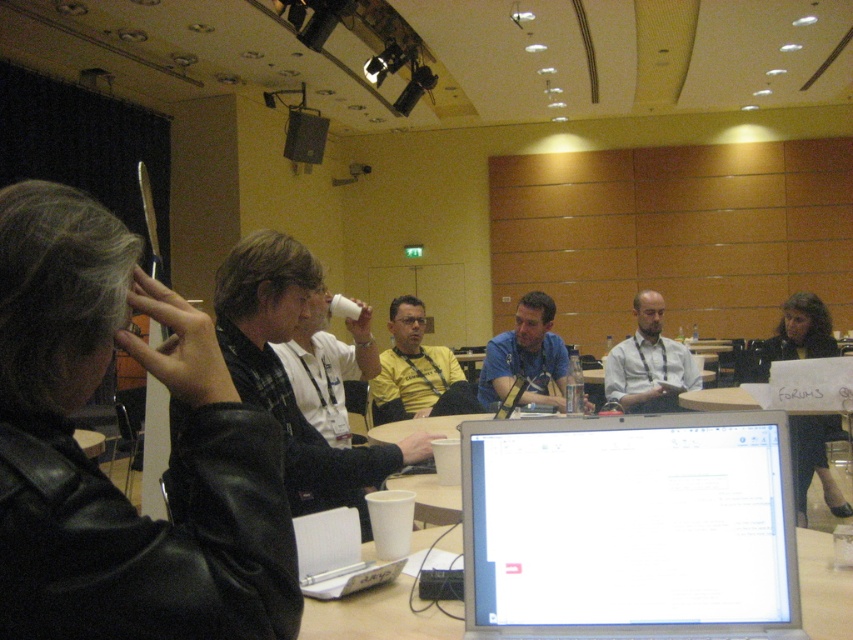
Who is more distant from viewer, (306, 269) or (347, 564)?

The point (306, 269) is more distant.

Looking at this image, is white matte cup at center below white plastic laptop at center?

No, white matte cup at center is not below white plastic laptop at center.

In the scene shown: Who is more distant from viewer, (x=291, y=266) or (x=334, y=545)?

The point (x=291, y=266) is more distant.

This screenshot has height=640, width=853. What are the coordinates of `white matte cup at center` in the screenshot? It's located at (286, 374).

Identify the location of white plastic laptop at center. This screenshot has width=853, height=640. (335, 556).

Is white plastic laptop at center taller than matte black speaker at upper center?

In fact, white plastic laptop at center may be shorter than matte black speaker at upper center.

Where is `white plastic laptop at center`? This screenshot has height=640, width=853. white plastic laptop at center is located at coordinates (335, 556).

Does silver metallic laptop at center have a lesser height compared to white plastic laptop at center?

In fact, silver metallic laptop at center may be taller than white plastic laptop at center.

Which of these two, silver metallic laptop at center or white plastic laptop at center, stands taller?

silver metallic laptop at center

Is point (679, 428) in front of point (347, 573)?

That is True.

This screenshot has height=640, width=853. I want to click on silver metallic laptop at center, so coord(630,528).